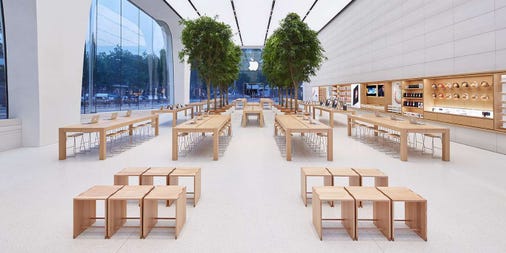
Locate an element on the screen. wall is located at coordinates (399, 53).